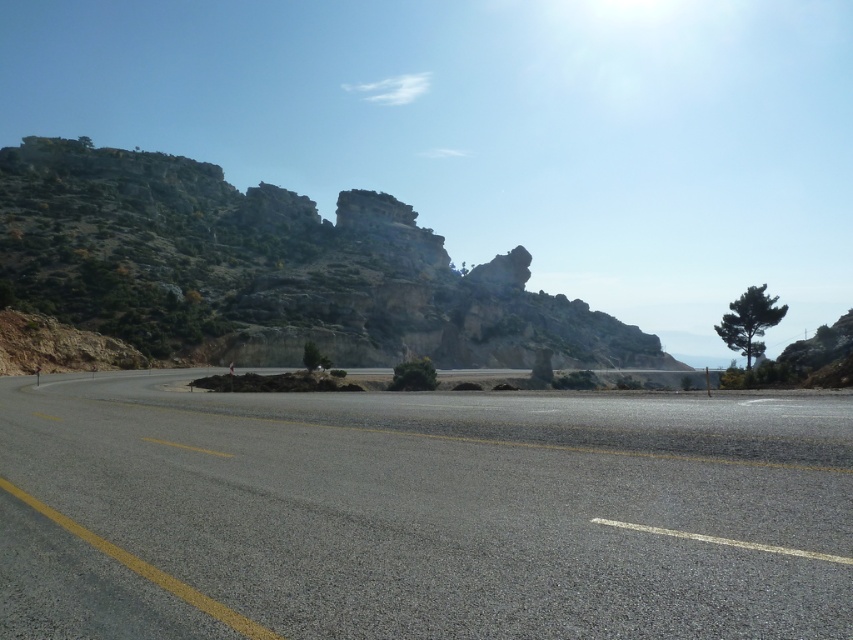
You are standing at the point with coordinates (x=422, y=513). According to the scene, what surface are you currently standing on?

The point with coordinates (x=422, y=513) is on asphalt road at center, so you are standing on the asphalt road at center.

You are a drone operator trying to capture aerial footage of the asphalt road at center. Your camera has a 100m focal length lens. If the road is at point 0.802, 0.497, what is the coordinate of the road in the image frame?

The coordinate of the asphalt road at center is at point (422, 513).